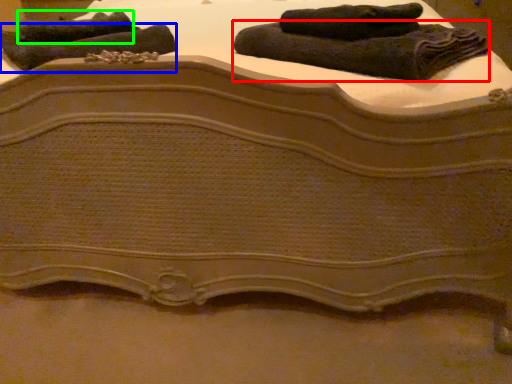
Question: Which object is positioned farthest from towel (highlighted by a red box)? Select from towel (highlighted by a blue box) and towel (highlighted by a green box).

Choices:
 (A) towel
 (B) towel

Answer: (B)